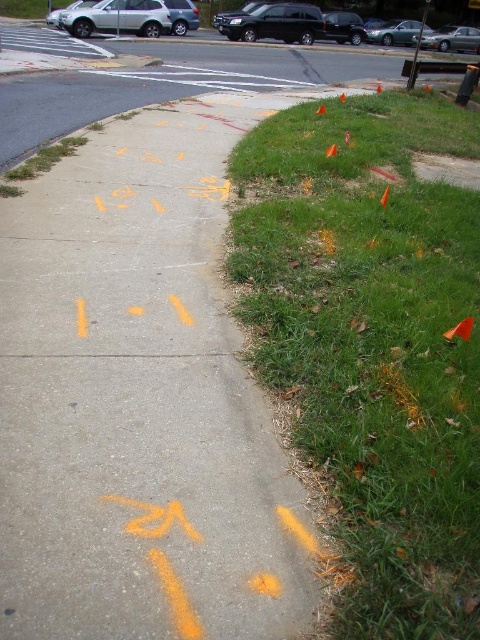
Question: Does silver metallic suv at upper left come in front of orange plastic traffic cone at lower right?

Choices:
 (A) no
 (B) yes

Answer: (A)

Question: Is orange plastic traffic cone at lower right wider than orange plastic traffic cone at upper center?

Choices:
 (A) no
 (B) yes

Answer: (B)

Question: Which point is closer to the camera?

Choices:
 (A) shiny black suv at upper center
 (B) orange fabric traffic cone at upper center
 (C) green grass at lower right

Answer: (C)

Question: Can you confirm if silver metallic sedan at upper right is thinner than orange plastic traffic cone at upper right?

Choices:
 (A) yes
 (B) no

Answer: (B)

Question: Among these objects, which one is farthest from the camera?

Choices:
 (A) shiny black suv at upper center
 (B) silver metallic sedan at upper right

Answer: (B)

Question: Estimate the real-world distances between objects in this image. Which object is closer to the orange plastic traffic cone at upper right?

Choices:
 (A) yellow chalk markings on sidewalk at center
 (B) silver metallic sedan at upper right
 (C) orange fabric traffic cone at upper center
 (D) orange plastic traffic cone at upper center

Answer: (D)